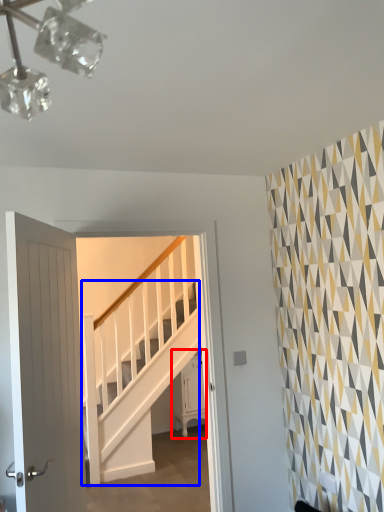
Question: Among these objects, which one is nearest to the camera, furniture (highlighted by a red box) or stairs (highlighted by a blue box)?

Choices:
 (A) furniture
 (B) stairs

Answer: (B)